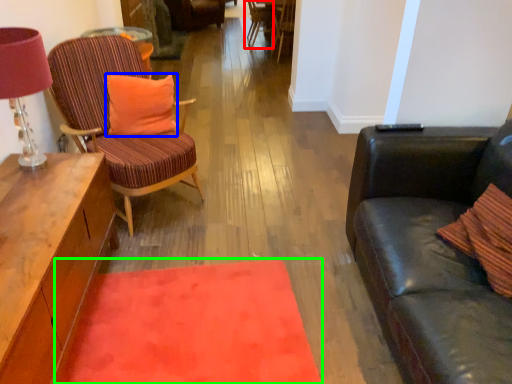
Question: Which object is positioned farthest from chair (highlighted by a red box)? Select from pillow (highlighted by a blue box) and mat (highlighted by a green box).

Choices:
 (A) pillow
 (B) mat

Answer: (B)